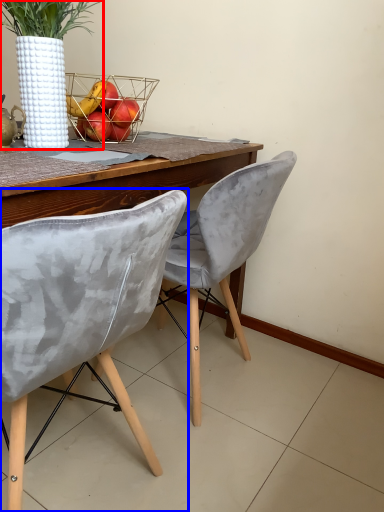
Question: Which object appears closest to the camera in this image, houseplant (highlighted by a red box) or chair (highlighted by a blue box)?

Choices:
 (A) houseplant
 (B) chair

Answer: (B)